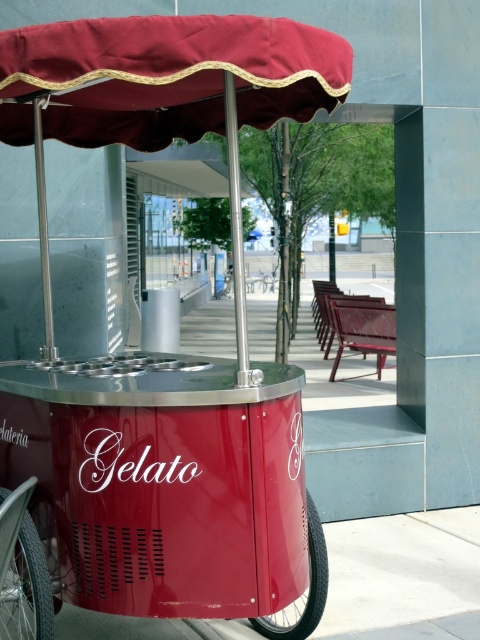
Is point (201, 388) less distant than point (31, 589)?

Yes, point (201, 388) is in front of point (31, 589).

Between point (111, 576) and point (19, 538), which one is positioned in front?

Positioned in front is point (111, 576).

This screenshot has width=480, height=640. I want to click on shiny red gelato cart at center, so click(168, 484).

Find the location of a particular element. The image size is (480, 640). shiny red gelato cart at left is located at coordinates (165, 356).

Between shiny red gelato cart at left and black rubber wheel at lower center, which one appears on the left side from the viewer's perspective?

From the viewer's perspective, shiny red gelato cart at left appears more on the left side.

Where is `shiny red gelato cart at left`? shiny red gelato cart at left is located at coordinates (165, 356).

Which of these two, maroon fabric canopy at upper center or black rubber wheel at lower center, stands shorter?

maroon fabric canopy at upper center is shorter.

Does point (202, 72) come behind point (323, 608)?

No, it is not.

Measure the distance between maroon fabric canopy at upper center and camera.

maroon fabric canopy at upper center is 9.09 feet from camera.

Identify the location of maroon fabric canopy at upper center. This screenshot has width=480, height=640. (165, 76).